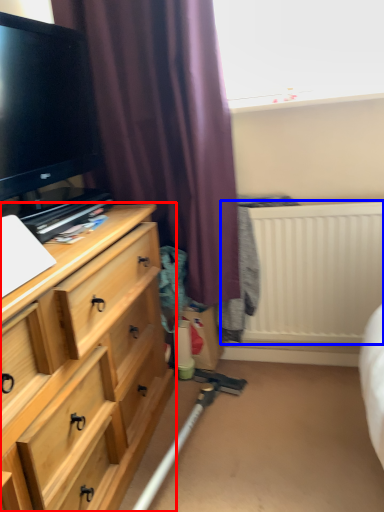
Question: Which object is closer to the camera taking this photo, chest of drawers (highlighted by a red box) or radiator (highlighted by a blue box)?

Choices:
 (A) chest of drawers
 (B) radiator

Answer: (A)